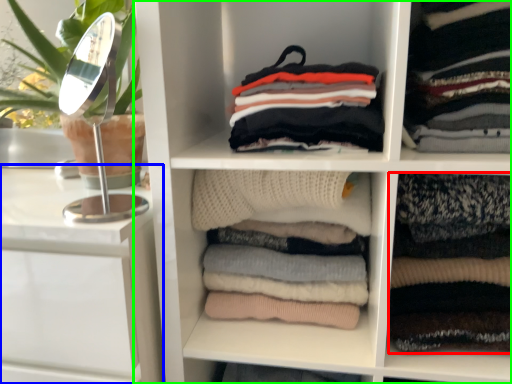
Question: Which is farther away from clothing (highlighted by a red box)? vanity (highlighted by a blue box) or shelf (highlighted by a green box)?

Choices:
 (A) vanity
 (B) shelf

Answer: (A)